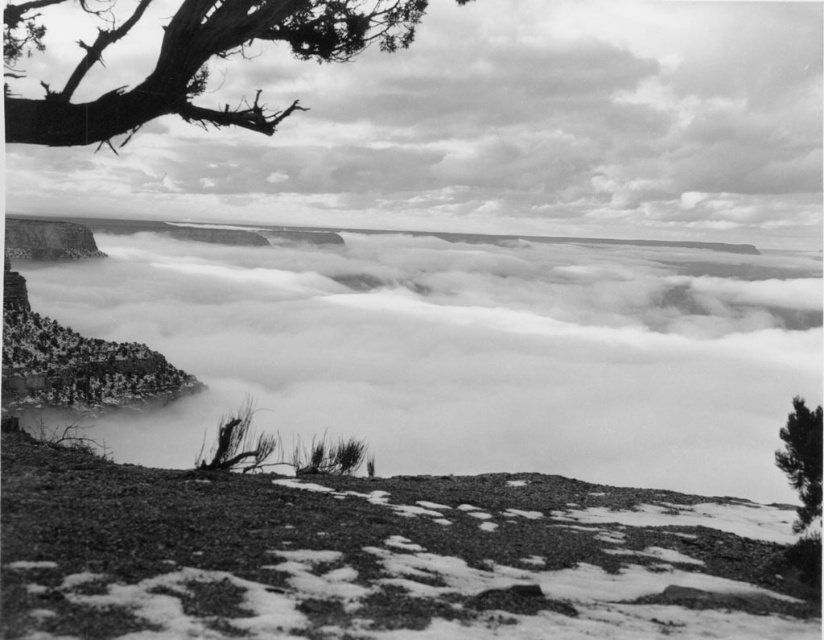
You are a photographer standing at the rough textured dirt at lower center, wanting to capture a photo of the smooth bark tree at upper right. Considering the distance between them, will you need a telephoto lens to get a clear shot of the tree from your current position?

The distance between the rough textured dirt at lower center and the smooth bark tree at upper right is 8.13 meters. A telephoto lens is typically used for distant subjects, but since 8.13 meters is relatively close, a standard lens might suffice for capturing the smooth bark tree at upper right clearly without needing significant zoom.

You are a photographer planning to capture the entire view of the Grand Canyon. You notice the fuzzy white cloud at upper center and the rough textured dirt at lower center in your frame. Which object occupies a wider area in the image?

The fuzzy white cloud at upper center occupies a wider area in the image since its width surpasses that of the rough textured dirt at lower center.

In the scene shown: You are a photographer standing at the edge of the Grand Canyon. You have a camera with a zoom lens that can focus on objects at different heights. You want to capture both the rough textured dirt at lower center and the smooth bark tree at upper right in the same frame. Based on their positions, which object will appear closer to the top of your photo?

The smooth bark tree at upper right will appear closer to the top of the photo because the rough textured dirt at lower center is above it, meaning the tree is positioned lower in the frame.